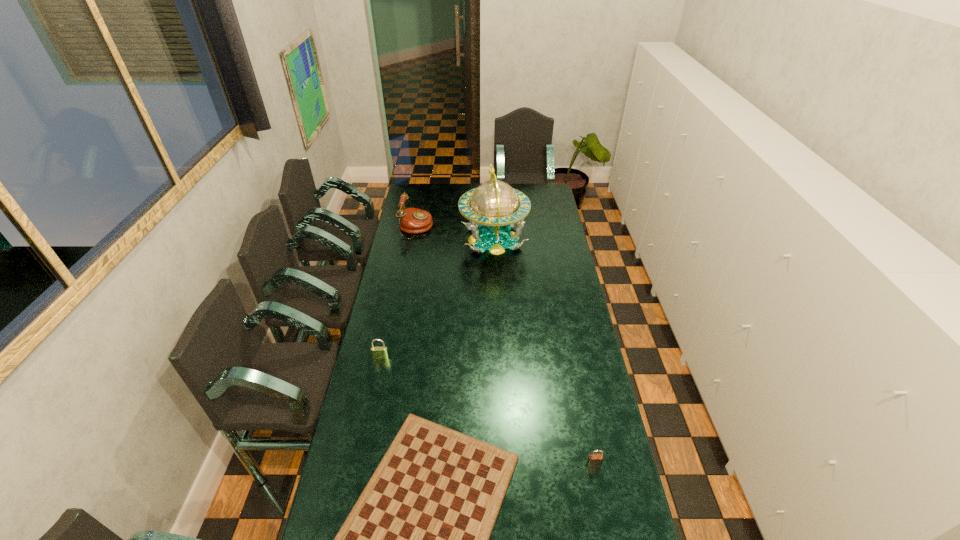
The image size is (960, 540). I want to click on free spot between the tallest object and the telephone, so click(455, 233).

You are a GUI agent. You are given a task and a screenshot of the screen. Output one action in this format:
    pyautogui.click(x=<x>, y=<y>)
    Task: Click on the unoccupied position between the shorter padlock and the fourth shortest object
    
    Given the screenshot: What is the action you would take?
    pyautogui.click(x=505, y=346)

I want to click on blank region between the farther padlock and the nearer padlock, so click(487, 411).

Where is `the second closest object to the nearer padlock`? The image size is (960, 540). the second closest object to the nearer padlock is located at coordinates (377, 352).

In order to click on object that ranks as the second closest to the gameboard in this screenshot , I will do `click(377, 352)`.

Image resolution: width=960 pixels, height=540 pixels. Find the location of `vacant space that satisfies the following two spatial constraints: 1. on the dial of the telephone; 2. on the right side of the tallest object`. vacant space that satisfies the following two spatial constraints: 1. on the dial of the telephone; 2. on the right side of the tallest object is located at coordinates tap(414, 239).

Find the location of a particular element. This screenshot has width=960, height=540. vacant area that satisfies the following two spatial constraints: 1. on the dial of the telephone; 2. on the front-facing side of the left padlock is located at coordinates (391, 357).

Identify the location of free space that satisfies the following two spatial constraints: 1. on the dial of the telephone; 2. on the front-facing side of the farther padlock. The height and width of the screenshot is (540, 960). (391, 357).

You are a GUI agent. You are given a task and a screenshot of the screen. Output one action in this format:
    pyautogui.click(x=<x>, y=<y>)
    Task: Click on the free space that satisfies the following two spatial constraints: 1. on the dial of the globe; 2. on the left side of the second tallest object
    Image resolution: width=960 pixels, height=540 pixels.
    Given the screenshot: What is the action you would take?
    pos(414,239)

Find the location of `vacant area in the image that satisfies the following two spatial constraints: 1. on the dial of the globe; 2. on the left side of the second tallest object`. vacant area in the image that satisfies the following two spatial constraints: 1. on the dial of the globe; 2. on the left side of the second tallest object is located at coordinates (414, 239).